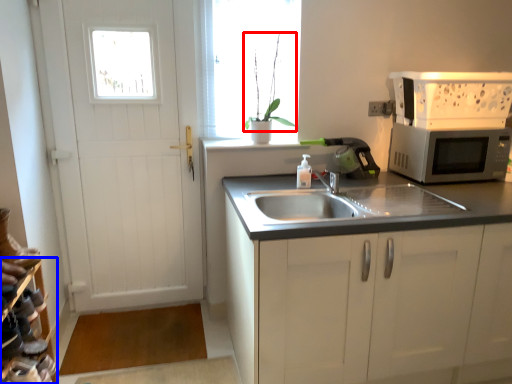
Question: Which of the following is the farthest to the observer, plant (highlighted by a red box) or shelf (highlighted by a blue box)?

Choices:
 (A) plant
 (B) shelf

Answer: (A)